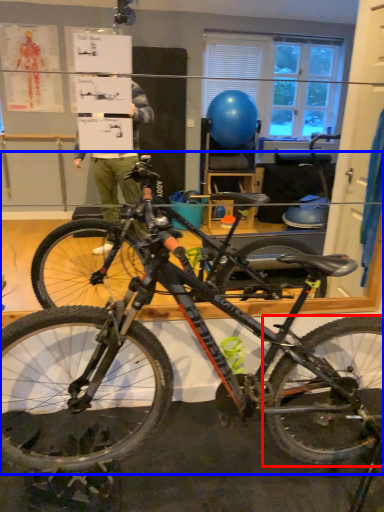
Question: Which object is further to the camera taking this photo, bicycle wheel (highlighted by a red box) or bicycle (highlighted by a blue box)?

Choices:
 (A) bicycle wheel
 (B) bicycle

Answer: (A)